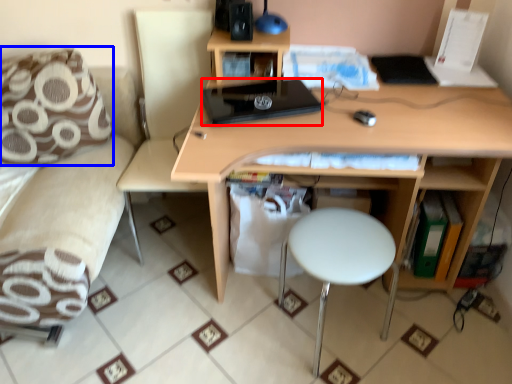
Question: Which of the following is the farthest to the observer, laptop (highlighted by a red box) or pillow (highlighted by a blue box)?

Choices:
 (A) laptop
 (B) pillow

Answer: (B)